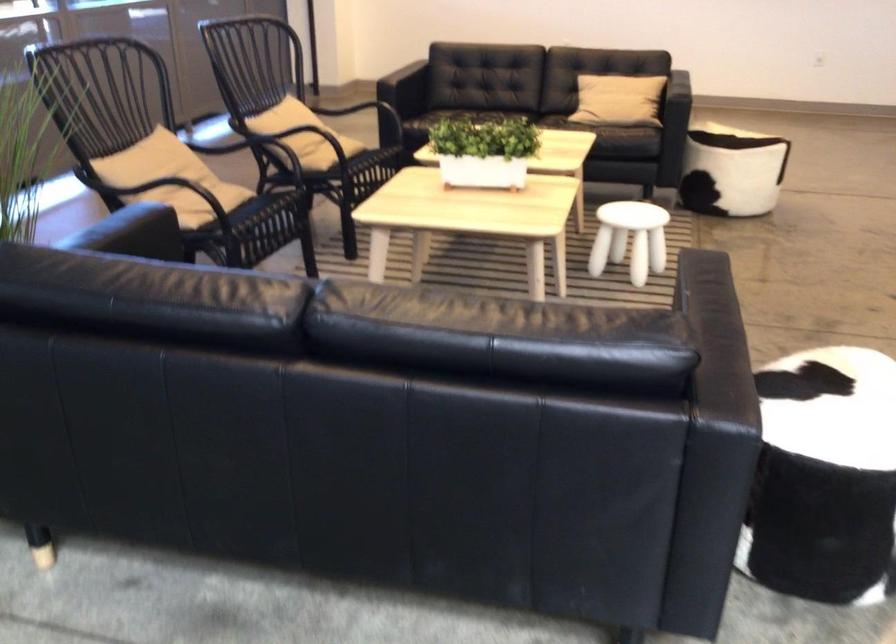
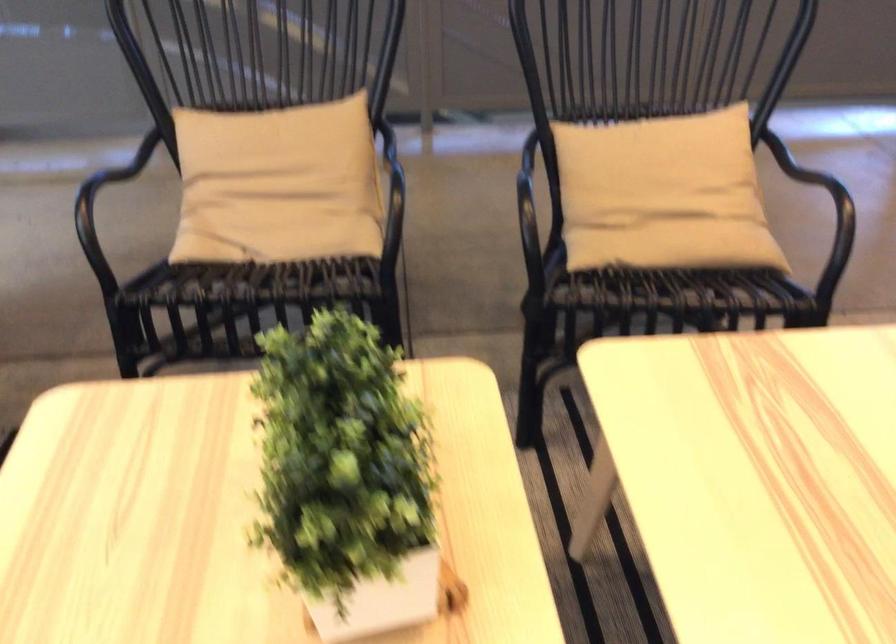
Find the pixel in the second image that matches pixel 177 184 in the first image.

(278, 184)